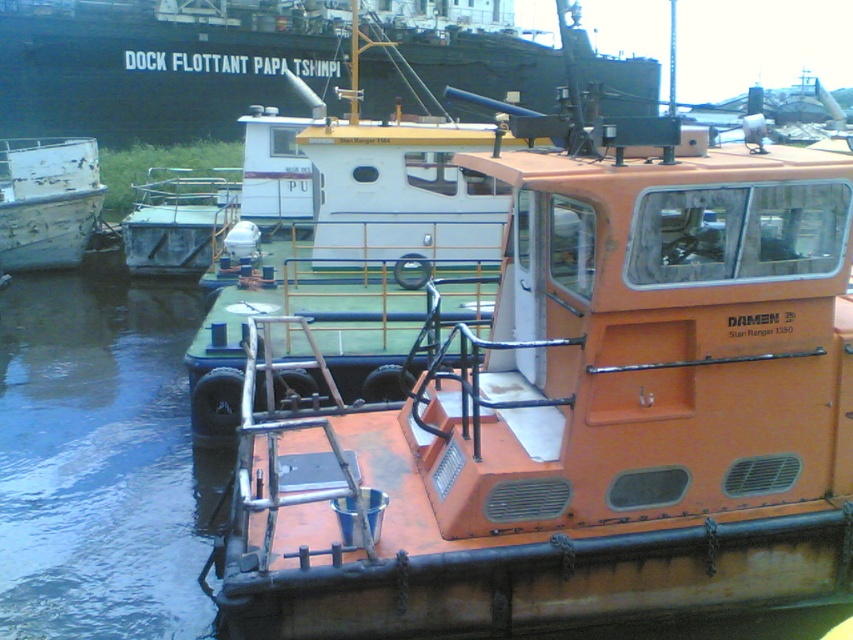
Question: Can you confirm if dark blue water at lower left is positioned to the left of green matte tugboat at center?

Choices:
 (A) yes
 (B) no

Answer: (A)

Question: Among these points, which one is farthest from the camera?

Choices:
 (A) (412, 172)
 (B) (54, 209)

Answer: (B)

Question: Does green matte tugboat at center lie behind metallic gray container at center-left?

Choices:
 (A) yes
 (B) no

Answer: (B)

Question: Which of these objects is positioned farthest from the green matte tugboat at center?

Choices:
 (A) orange matte boat at center
 (B) white weathered boat at left

Answer: (B)

Question: Which of the following is the closest to the observer?

Choices:
 (A) (146, 224)
 (B) (42, 192)

Answer: (A)

Question: Does orange matte boat at center appear on the right side of metallic gray container at center-left?

Choices:
 (A) yes
 (B) no

Answer: (A)